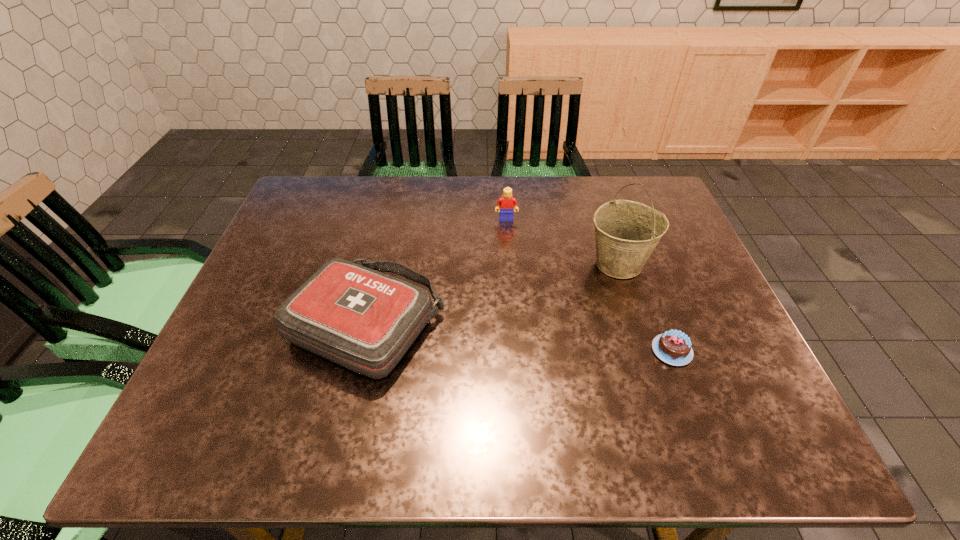
This screenshot has height=540, width=960. What are the coordinates of `the tallest object` in the screenshot? It's located at (627, 232).

The height and width of the screenshot is (540, 960). What are the coordinates of `Lego` in the screenshot? It's located at (506, 204).

Find the location of a particular element. Image resolution: width=960 pixels, height=540 pixels. the second object from left to right is located at coordinates (506, 204).

Where is `the leftmost object`? This screenshot has width=960, height=540. the leftmost object is located at coordinates (x=364, y=320).

Where is `chocolate cake`? chocolate cake is located at coordinates (673, 347).

Find the location of `blank space located on the back of the tallest object`. blank space located on the back of the tallest object is located at coordinates (603, 217).

Image resolution: width=960 pixels, height=540 pixels. Find the location of `vacant position located 0.210m on the face of the Lego`. vacant position located 0.210m on the face of the Lego is located at coordinates (510, 272).

Find the location of a particular element. free spot located on the back of the first-aid kit is located at coordinates (385, 247).

Locate an element on the screen. The image size is (960, 540). vacant space located on the back of the chocolate cake is located at coordinates (649, 290).

In order to click on object that is at the far edge in this screenshot , I will do `click(506, 204)`.